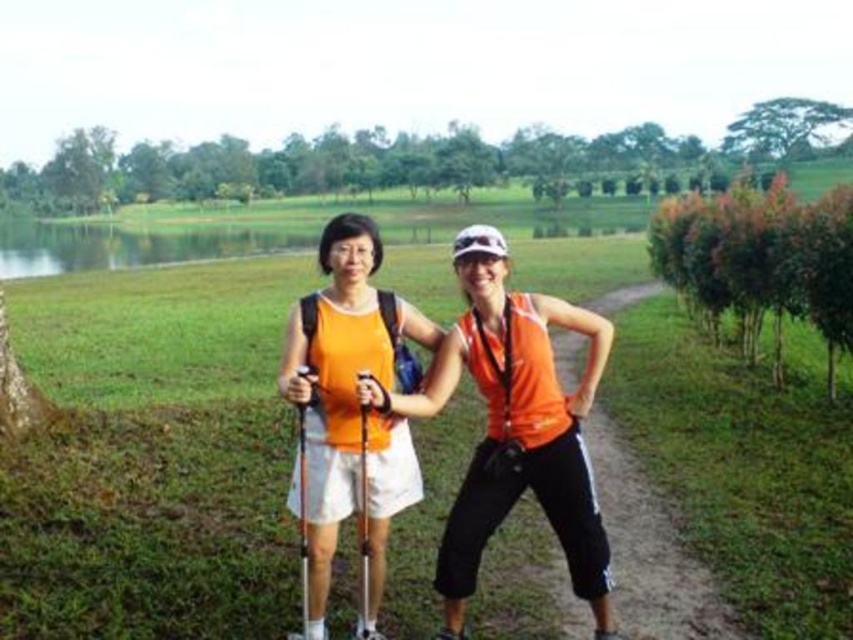
You are a photographer trying to capture both individuals in a single frame. Given that the orange matte tank top at center and the matte orange tank top at center are of different sizes in the image, which one would appear closer to the camera?

The orange matte tank top at center appears closer to the camera because objects that are smaller in the image are typically farther away, but since it is stated to be smaller than the other, there might be an inconsistency. Wait, actually, in perspective, larger objects in the image are closer. Since the orange matte tank top at center is smaller than the matte orange tank top at center, this suggests that the latter is closer. However, both have the same label except for the order. Maybe there was a typo.

You are a photographer trying to capture both the orange matte tank top at center and the matte orange tank top at center in a single frame. Since they are different in height, which one should you focus on to ensure both are fully visible in your shot?

The orange matte tank top at center is shorter than the matte orange tank top at center, so you should focus on the shorter one to ensure both are fully visible in your shot.

You are a photographer positioned at the orange matte tank top at center. You want to take a photo of the other person who is 5.04 meters away. What is the minimum distance you need to move forward so that the other person is within your camera frame which has a 4 meter focal length?

Since the other person is 5.04 meters away and your camera has a 4 meter focal length, you need to move forward by 1.04 meters to ensure the person is within the frame.